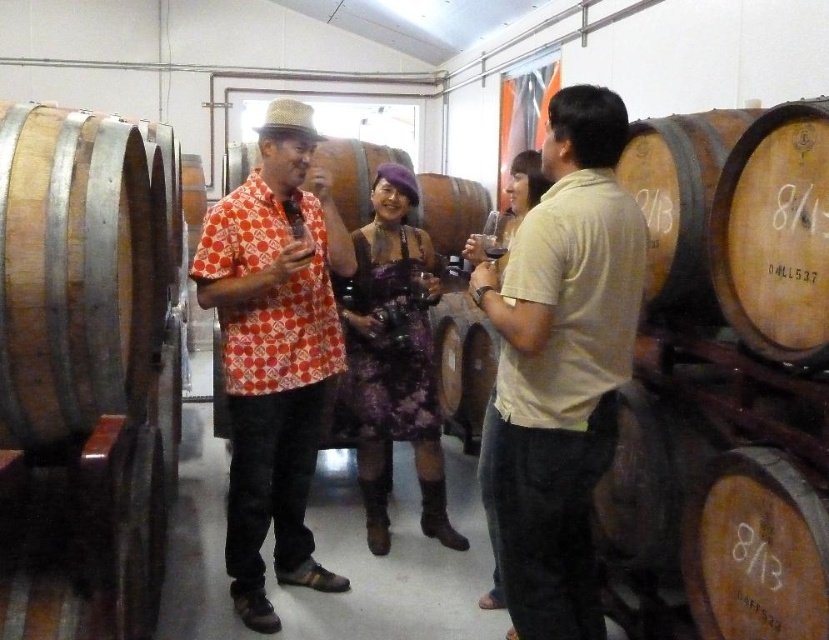
Is beige cotton shirt at center shorter than purple lace dress at center?

Correct, beige cotton shirt at center is not as tall as purple lace dress at center.

Image resolution: width=829 pixels, height=640 pixels. What do you see at coordinates (561, 364) in the screenshot?
I see `beige cotton shirt at center` at bounding box center [561, 364].

Is point (592, 432) in front of point (371, 232)?

Yes, point (592, 432) is closer to viewer.

Locate an element on the screen. This screenshot has width=829, height=640. beige cotton shirt at center is located at coordinates (561, 364).

Can you confirm if beige cotton shirt at center is wider than dark glass wine at center?

Yes, beige cotton shirt at center is wider than dark glass wine at center.

Who is more distant from viewer, (565, 580) or (497, 259)?

Positioned behind is point (497, 259).

Where is `beige cotton shirt at center`? This screenshot has width=829, height=640. beige cotton shirt at center is located at coordinates (561, 364).

Consider the image. How far apart are beige cotton shirt at center and printed cotton shirt at center?

beige cotton shirt at center is 35.56 inches from printed cotton shirt at center.

You are a GUI agent. You are given a task and a screenshot of the screen. Output one action in this format:
    pyautogui.click(x=<x>, y=<y>)
    Task: Click on the beige cotton shirt at center
    
    Given the screenshot: What is the action you would take?
    pyautogui.click(x=561, y=364)

At what (x,y) coordinates should I click in order to perform the action: click on beige cotton shirt at center. Please return your answer as a coordinate pair (x, y). The image size is (829, 640). Looking at the image, I should click on (561, 364).